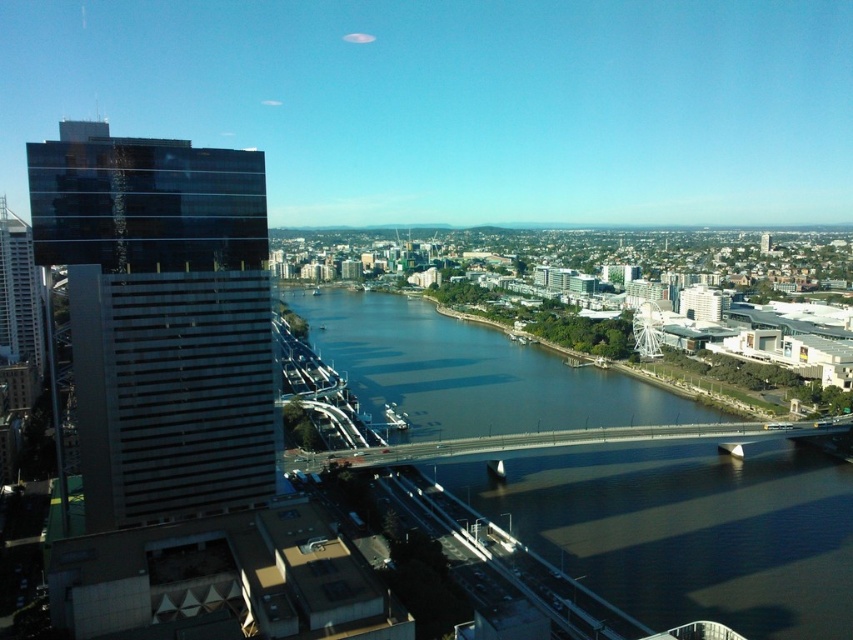
You are a tourist standing on the left bank of the river in the city. You see the dark blue water at center and the smooth concrete bridge at center. Which object is closer to your left side?

The dark blue water at center is closer to your left side since it is positioned to the left of the smooth concrete bridge at center.

You are a drone operator who needs to capture a closeup shot of the dark blue water at center. What coordinate should you aim for?

The dark blue water at center is located at point (688, 531), so you should aim for that coordinate.

You are standing on the bridge that spans the river. Looking down, you see the dark blue water at center and the dark glass skyscraper at left. Which object is closer to your feet?

The dark blue water at center is closer to your feet because it is located below the dark glass skyscraper at left.